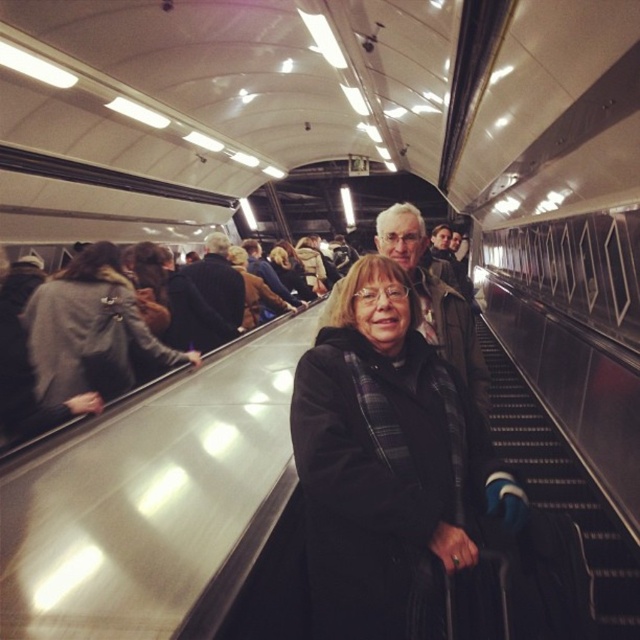
Does dark brown leather jacket at center have a larger size compared to plaid wool coat at center?

Incorrect, dark brown leather jacket at center is not larger than plaid wool coat at center.

Who is more forward, (196,268) or (257,300)?

Positioned in front is point (196,268).

Identify the location of dark brown leather jacket at center. (218, 280).

Can you confirm if dark brown leather jacket at center is positioned to the right of matte black coat at center?

In fact, dark brown leather jacket at center is to the left of matte black coat at center.

Can you confirm if dark brown leather jacket at center is positioned below matte black coat at center?

Yes.

Image resolution: width=640 pixels, height=640 pixels. What do you see at coordinates (218, 280) in the screenshot?
I see `dark brown leather jacket at center` at bounding box center [218, 280].

Where is `dark brown leather jacket at center`? Image resolution: width=640 pixels, height=640 pixels. dark brown leather jacket at center is located at coordinates (218, 280).

Which of these two, black metal stairs at lower right or matte brown coat at center, stands taller?

Standing taller between the two is black metal stairs at lower right.

Is black metal stairs at lower right positioned behind matte brown coat at center?

Yes.

Between point (573, 472) and point (467, 358), which one is positioned behind?

The point (573, 472) is more distant.

Image resolution: width=640 pixels, height=640 pixels. Find the location of `black metal stairs at lower right`. black metal stairs at lower right is located at coordinates (563, 490).